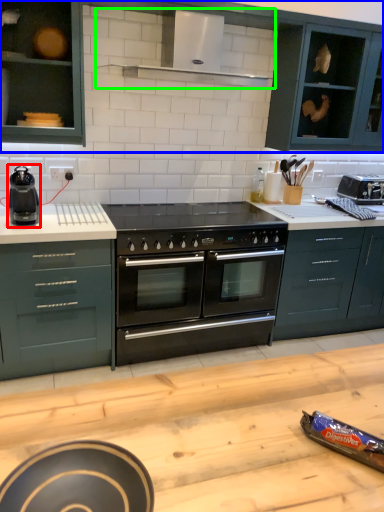
Question: Which object is the closest to the kitchen appliance (highlighted by a red box)? Choose among these: cabinetry (highlighted by a blue box) or exhaust hood (highlighted by a green box).

Choices:
 (A) cabinetry
 (B) exhaust hood

Answer: (A)